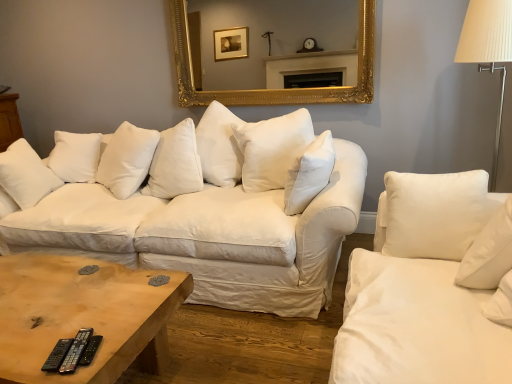
Question: Is black rubber remote at lower left, arranged as the first remote when viewed from the left, taller than black plastic remote at lower left, which ranks as the 2th remote in left-to-right order?

Choices:
 (A) no
 (B) yes

Answer: (A)

Question: From the image's perspective, is black rubber remote at lower left, arranged as the first remote when viewed from the left, on black plastic remote at lower left, which ranks as the 2th remote in left-to-right order?

Choices:
 (A) yes
 (B) no

Answer: (B)

Question: Can you confirm if black rubber remote at lower left, the second remote in the right-to-left sequence, is wider than black plastic remote at lower left, which ranks as the 2th remote in left-to-right order?

Choices:
 (A) yes
 (B) no

Answer: (A)

Question: From a real-world perspective, does black rubber remote at lower left, the second remote in the right-to-left sequence, sit lower than black plastic remote at lower left, which is counted as the 1th remote, starting from the right?

Choices:
 (A) yes
 (B) no

Answer: (A)

Question: Does black rubber remote at lower left, the second remote in the right-to-left sequence, have a larger size compared to black plastic remote at lower left, which ranks as the 2th remote in left-to-right order?

Choices:
 (A) no
 (B) yes

Answer: (B)

Question: Considering the positions of white cotton couch at center and wooden coffee table at center in the image, is white cotton couch at center wider or thinner than wooden coffee table at center?

Choices:
 (A) thin
 (B) wide

Answer: (B)

Question: From a real-world perspective, is white cotton couch at center positioned above or below wooden coffee table at center?

Choices:
 (A) above
 (B) below

Answer: (A)

Question: From the image's perspective, is white cotton couch at center above or below wooden coffee table at center?

Choices:
 (A) above
 (B) below

Answer: (A)

Question: Based on their sizes in the image, would you say white cotton couch at center is bigger or smaller than wooden coffee table at center?

Choices:
 (A) small
 (B) big

Answer: (B)

Question: In the image, is white cotton pillow at center, marked as the first pillow in a front-to-back arrangement, on the left side or the right side of gold ornate mirror at upper center?

Choices:
 (A) right
 (B) left

Answer: (A)

Question: From their relative heights in the image, would you say white cotton pillow at center, which is counted as the 2th pillow, starting from the left, is taller or shorter than gold ornate mirror at upper center?

Choices:
 (A) tall
 (B) short

Answer: (B)

Question: Considering the positions of point (313, 162) and point (338, 94), is point (313, 162) closer or farther from the camera than point (338, 94)?

Choices:
 (A) closer
 (B) farther

Answer: (A)

Question: Is white cotton pillow at center, the 2th pillow viewed from the back, bigger or smaller than gold ornate mirror at upper center?

Choices:
 (A) big
 (B) small

Answer: (B)

Question: Considering their positions, is white cotton couch at center located in front of or behind black plastic remote at lower left, which is counted as the 1th remote, starting from the right?

Choices:
 (A) front
 (B) behind

Answer: (B)

Question: Looking at their shapes, would you say white cotton couch at center is wider or thinner than black plastic remote at lower left, which is counted as the 1th remote, starting from the right?

Choices:
 (A) thin
 (B) wide

Answer: (B)